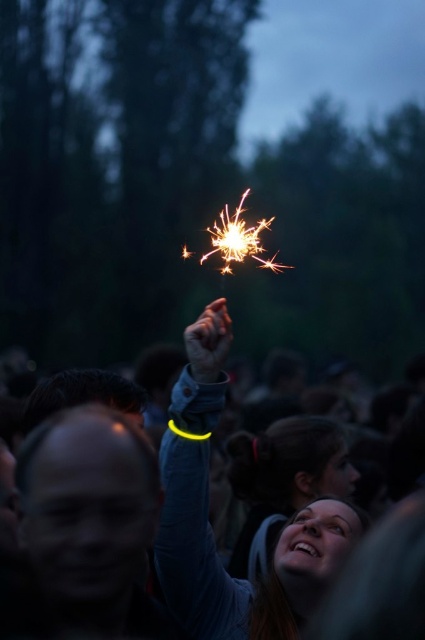
Question: Which point is closer to the camera taking this photo?

Choices:
 (A) (300, 595)
 (B) (204, 484)

Answer: (A)

Question: In this image, where is yellow glow-in-the-dark wristband at upper center located relative to smooth skin face at upper center?

Choices:
 (A) right
 (B) left

Answer: (B)

Question: Does yellow glow-in-the-dark wristband at upper center have a greater width compared to smooth skin face at upper center?

Choices:
 (A) no
 (B) yes

Answer: (B)

Question: Does yellow glow-in-the-dark wristband at upper center appear over smooth skin face at upper center?

Choices:
 (A) yes
 (B) no

Answer: (A)